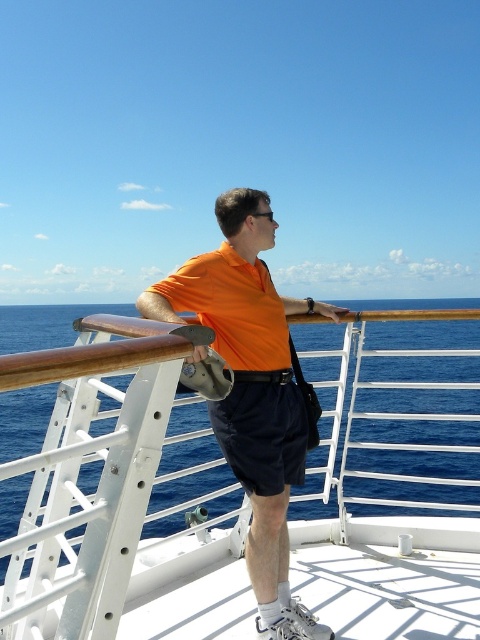
You are on the deck of a ship and want to place two markers at point (280, 369) and point (266, 440). Which point is closer to you?

Point (280, 369) is further to the viewer than point (266, 440), so the closer point is point (266, 440).

From the picture: You are on the ship deck and want to move from point A to point B. Point A is at coordinate point (380, 362) and point B is at coordinate point (294, 412). Which point is closer to you when you are standing at the railing where the person is?

Point A at coordinate point (380, 362) is closer to you because it is further to the viewer than point B at coordinate point (294, 412).

You are a photographer on a ship deck. You need to take a photo of the orange matte shirt at center from a distance of 2 meters. Can you do it?

The orange matte shirt at center and camera are 1.92 meters apart, so yes, you can take the photo from 2 meters away since the distance is sufficient.